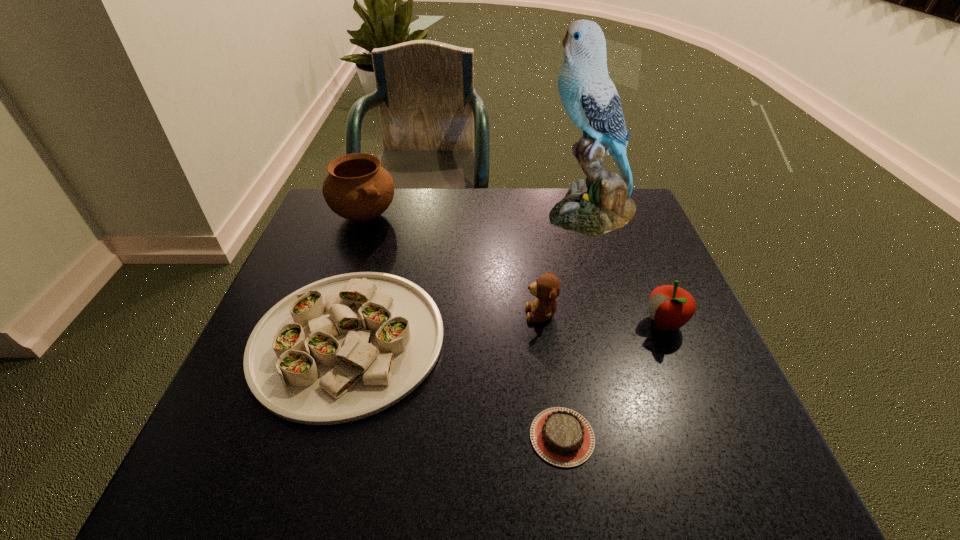
The width and height of the screenshot is (960, 540). What are the coordinates of `platter that is at the left edge` in the screenshot? It's located at (346, 347).

Image resolution: width=960 pixels, height=540 pixels. In order to click on parakeet that is positioned at the right edge in this screenshot , I will do `click(589, 96)`.

Find the location of `apple that is at the right edge`. apple that is at the right edge is located at coordinates (671, 307).

Locate an element on the screen. Image resolution: width=960 pixels, height=540 pixels. object positioned at the far left corner is located at coordinates (357, 188).

Identify the location of object situated at the far right corner. (589, 96).

In the image, there is a desktop. Where is `free space at the far edge`? The width and height of the screenshot is (960, 540). free space at the far edge is located at coordinates (x=482, y=205).

Locate an element on the screen. Image resolution: width=960 pixels, height=540 pixels. free location at the near edge of the desktop is located at coordinates (423, 489).

Find the location of a particular element. The image size is (960, 540). vacant point at the left edge is located at coordinates (266, 424).

Where is `free space at the right edge of the desktop`? free space at the right edge of the desktop is located at coordinates (701, 397).

Where is `vacant area at the far right corner`? vacant area at the far right corner is located at coordinates (641, 220).